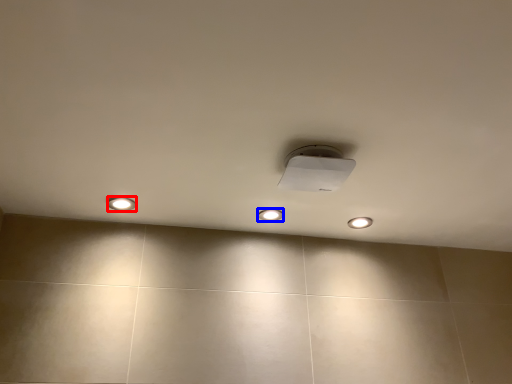
Question: Which point is closer to the camera, dot (highlighted by a red box) or dot (highlighted by a blue box)?

Choices:
 (A) dot
 (B) dot

Answer: (A)